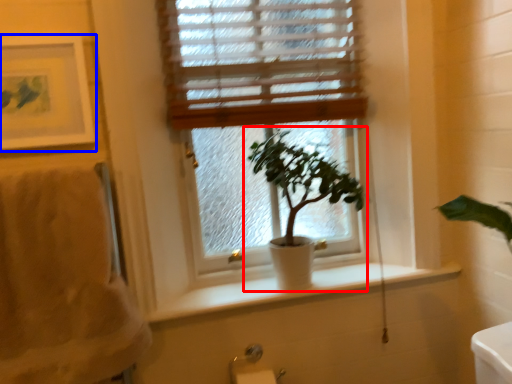
Question: Which of the following is the closest to the observer, houseplant (highlighted by a red box) or picture frame (highlighted by a blue box)?

Choices:
 (A) houseplant
 (B) picture frame

Answer: (B)